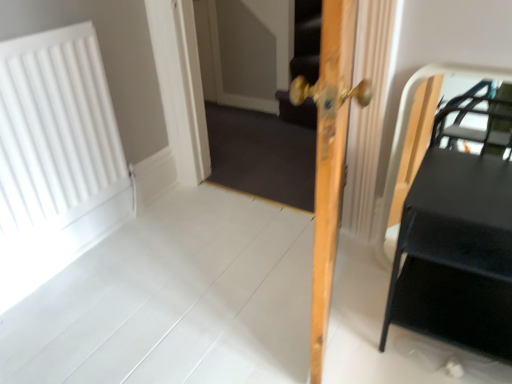
I want to click on vacant area that is situated to the right of white matte radiator at left, so [167, 252].